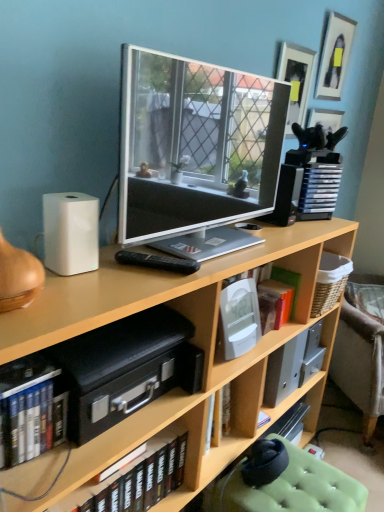
Question: Is white plastic speaker at right, which ranks as the first speaker in top-to-bottom order, oriented away from matte silver tv at center?

Choices:
 (A) no
 (B) yes

Answer: (A)

Question: Considering the relative sizes of white plastic speaker at right, the 2th speaker positioned from the left, and matte silver tv at center in the image provided, is white plastic speaker at right, the 2th speaker positioned from the left, smaller than matte silver tv at center?

Choices:
 (A) yes
 (B) no

Answer: (A)

Question: Considering the relative positions of white plastic speaker at right, the 2th speaker positioned from the left, and matte silver tv at center in the image provided, is white plastic speaker at right, the 2th speaker positioned from the left, to the right of matte silver tv at center from the viewer's perspective?

Choices:
 (A) no
 (B) yes

Answer: (B)

Question: From a real-world perspective, does white plastic speaker at right, which ranks as the first speaker in top-to-bottom order, stand above matte silver tv at center?

Choices:
 (A) yes
 (B) no

Answer: (B)

Question: From the image's perspective, is white plastic speaker at right, which is the second speaker in bottom-to-top order, located beneath matte silver tv at center?

Choices:
 (A) yes
 (B) no

Answer: (A)

Question: Does white plastic speaker at right, marked as the 2th speaker in a front-to-back arrangement, have a larger size compared to matte silver tv at center?

Choices:
 (A) no
 (B) yes

Answer: (A)

Question: Can we say matte black picture frame at upper right, the first picture frame from the left, lies outside orange matte book at center-right, the 3th book viewed from the left?

Choices:
 (A) yes
 (B) no

Answer: (A)

Question: Considering the relative sizes of matte black picture frame at upper right, the first picture frame from the left, and orange matte book at center-right, the 3th book viewed from the left, in the image provided, is matte black picture frame at upper right, the first picture frame from the left, thinner than orange matte book at center-right, the 3th book viewed from the left,?

Choices:
 (A) no
 (B) yes

Answer: (B)

Question: Is matte black picture frame at upper right, the second picture frame viewed from the right, surrounding orange matte book at center-right, arranged as the 3th book when ordered from the bottom?

Choices:
 (A) yes
 (B) no

Answer: (B)

Question: Can you confirm if matte black picture frame at upper right, the first picture frame from the left, is positioned to the left of orange matte book at center-right, positioned as the first book in right-to-left order?

Choices:
 (A) yes
 (B) no

Answer: (B)

Question: Does matte black picture frame at upper right, the second picture frame viewed from the right, have a smaller size compared to orange matte book at center-right, the 1th book from the back?

Choices:
 (A) yes
 (B) no

Answer: (B)

Question: Is matte black picture frame at upper right, the first picture frame from the left, closer to the viewer compared to orange matte book at center-right, arranged as the 3th book when ordered from the bottom?

Choices:
 (A) yes
 (B) no

Answer: (B)

Question: Is orange matte book at center-right, positioned as the first book in right-to-left order, oriented towards light brown wood bookcase at center?

Choices:
 (A) no
 (B) yes

Answer: (B)